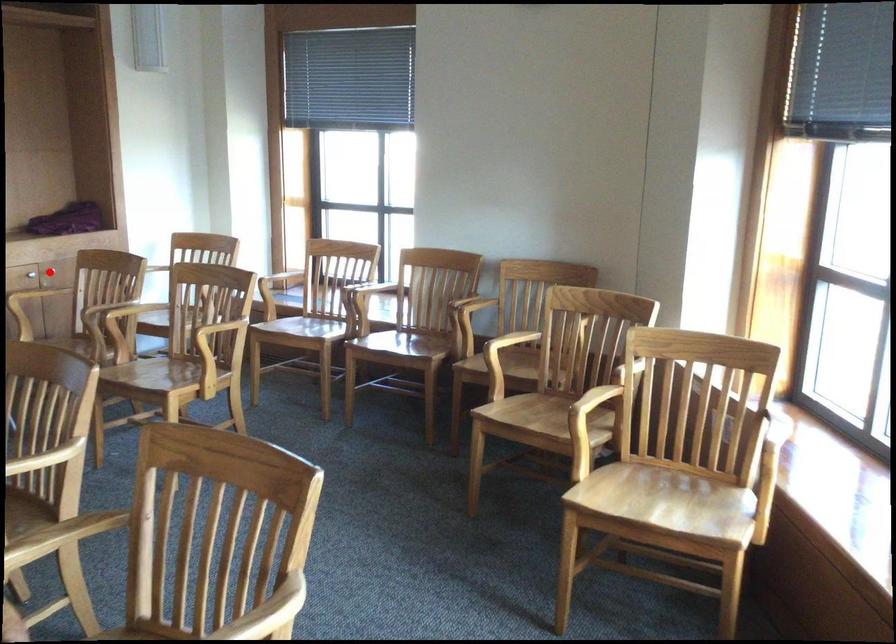
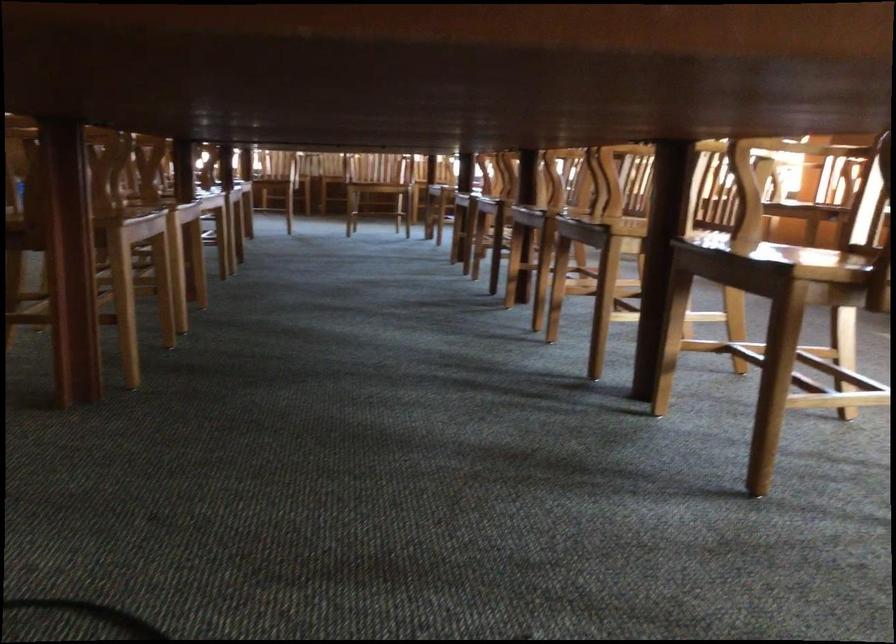
Question: I am providing you with two images of the same scene from different viewpoints. A red point is marked on the first image. Can you still see the location of the red point in image 2?

Choices:
 (A) Yes
 (B) No

Answer: (B)